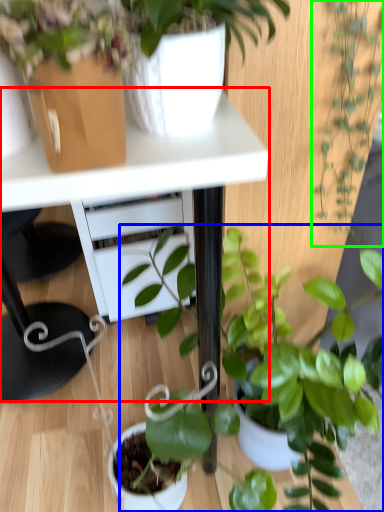
Question: Estimate the real-world distances between objects in this image. Which object is closer to table (highlighted by a red box), houseplant (highlighted by a blue box) or houseplant (highlighted by a green box)?

Choices:
 (A) houseplant
 (B) houseplant

Answer: (B)